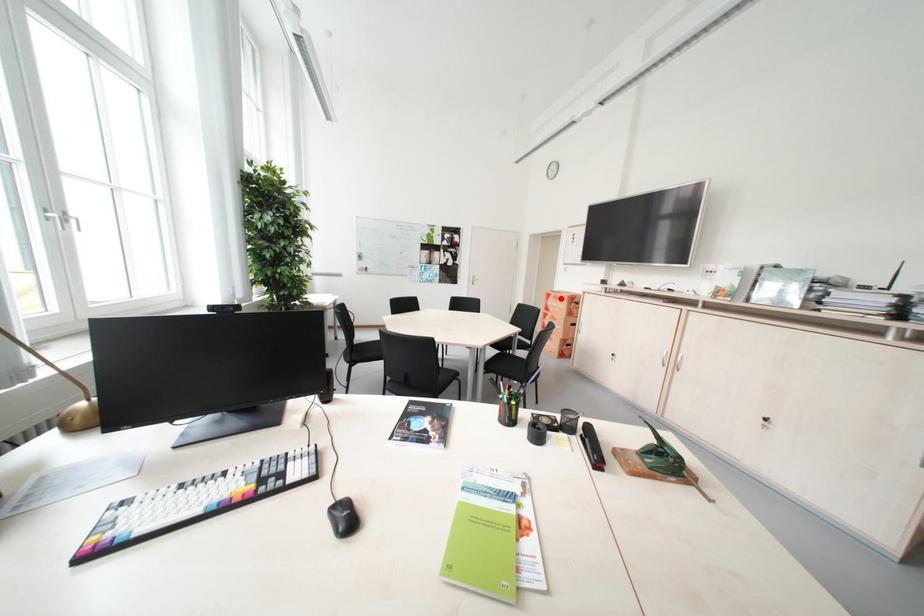
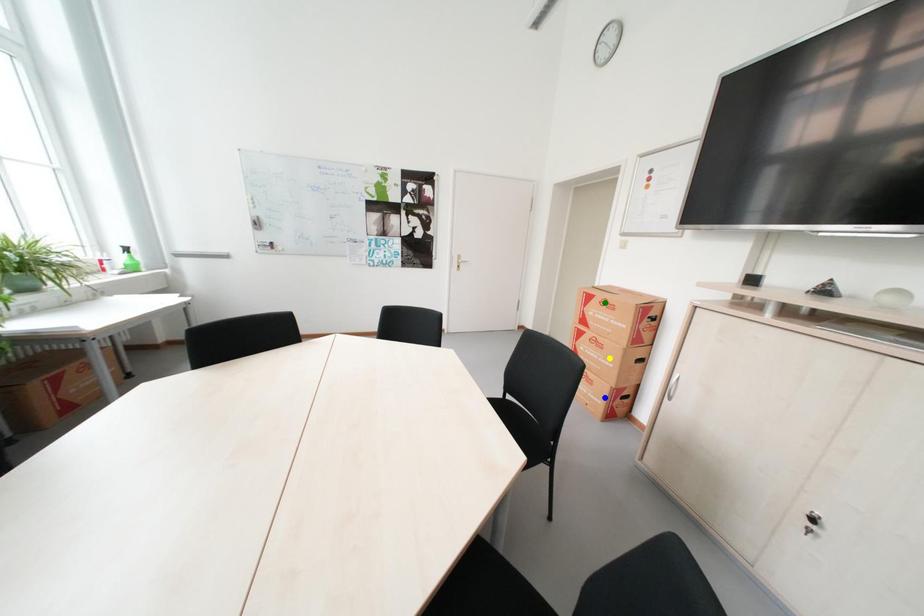
Question: I am providing you with two images of the same scene from different viewpoints. A red point is marked on the first image. You are given multiple points on the second image. In image 2, which mark is for the same physical point as the one in image 1?

Choices:
 (A) yellow point
 (B) blue point
 (C) green point

Answer: (C)